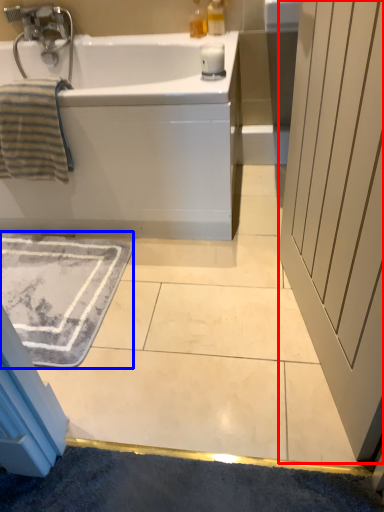
Question: Which object is closer to the camera taking this photo, screen door (highlighted by a red box) or bath mat (highlighted by a blue box)?

Choices:
 (A) screen door
 (B) bath mat

Answer: (A)